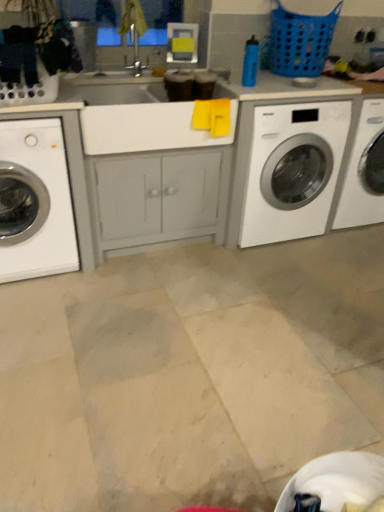
Where is `white glossy washing machine at center right, which is counted as the first washing machine, starting from the right`? The width and height of the screenshot is (384, 512). white glossy washing machine at center right, which is counted as the first washing machine, starting from the right is located at coordinates (293, 170).

You are a GUI agent. You are given a task and a screenshot of the screen. Output one action in this format:
    pyautogui.click(x=<x>, y=<y>)
    Task: Click on the blue plastic laundry basket at upper right
    
    Given the screenshot: What is the action you would take?
    (300, 42)

Which object is positioned more to the right, white glossy washing machine at left, which ranks as the 1th washing machine in left-to-right order, or white glossy washing machine at center right, which is counted as the first washing machine, starting from the right?

Positioned to the right is white glossy washing machine at center right, which is counted as the first washing machine, starting from the right.

Looking at this image, does white glossy washing machine at left, which ranks as the 1th washing machine in left-to-right order, come in front of white glossy washing machine at center right, which is counted as the first washing machine, starting from the right?

Yes, white glossy washing machine at left, which ranks as the 1th washing machine in left-to-right order, is in front of white glossy washing machine at center right, which is counted as the first washing machine, starting from the right.

How different are the orientations of white glossy washing machine at left, which ranks as the 1th washing machine in left-to-right order, and white glossy washing machine at center right, which is counted as the first washing machine, starting from the right, in degrees?

There is a 1.82e-05-degree angle between the facing directions of white glossy washing machine at left, which ranks as the 1th washing machine in left-to-right order, and white glossy washing machine at center right, which is counted as the first washing machine, starting from the right.

Does white glossy washing machine at left, positioned as the second washing machine in right-to-left order, have a lesser width compared to white glossy washing machine at center right, which is counted as the first washing machine, starting from the right?

Incorrect, the width of white glossy washing machine at left, positioned as the second washing machine in right-to-left order, is not less than that of white glossy washing machine at center right, which is counted as the first washing machine, starting from the right.

From a real-world perspective, is blue plastic laundry basket at upper right on top of white glossy washing machine at center right, the 2th washing machine from the left?

Correct, in the physical world, blue plastic laundry basket at upper right is higher than white glossy washing machine at center right, the 2th washing machine from the left.

Considering the positions of objects blue plastic laundry basket at upper right and white glossy washing machine at center right, which is counted as the first washing machine, starting from the right, in the image provided, who is behind, blue plastic laundry basket at upper right or white glossy washing machine at center right, which is counted as the first washing machine, starting from the right,?

blue plastic laundry basket at upper right is more distant.

Is blue plastic laundry basket at upper right wider than white glossy washing machine at center right, the 2th washing machine from the left?

In fact, blue plastic laundry basket at upper right might be narrower than white glossy washing machine at center right, the 2th washing machine from the left.

Is blue plastic laundry basket at upper right bigger than white glossy washing machine at center right, the 2th washing machine from the left?

Incorrect, blue plastic laundry basket at upper right is not larger than white glossy washing machine at center right, the 2th washing machine from the left.

Who is shorter, white glossy washing machine at center right, the 2th washing machine from the left, or blue plastic laundry basket at upper right?

blue plastic laundry basket at upper right.

Considering the relative sizes of white glossy washing machine at center right, which is counted as the first washing machine, starting from the right, and blue plastic laundry basket at upper right in the image provided, is white glossy washing machine at center right, which is counted as the first washing machine, starting from the right, wider than blue plastic laundry basket at upper right?

Result: Yes, white glossy washing machine at center right, which is counted as the first washing machine, starting from the right, is wider than blue plastic laundry basket at upper right.

Consider the image. Between white glossy washing machine at center right, which is counted as the first washing machine, starting from the right, and blue plastic laundry basket at upper right, which one has larger size?

With larger size is white glossy washing machine at center right, which is counted as the first washing machine, starting from the right.

Is white glossy washing machine at left, positioned as the second washing machine in right-to-left order, taller than blue plastic laundry basket at upper right?

Indeed, white glossy washing machine at left, positioned as the second washing machine in right-to-left order, has a greater height compared to blue plastic laundry basket at upper right.

Are white glossy washing machine at left, which ranks as the 1th washing machine in left-to-right order, and blue plastic laundry basket at upper right making contact?

No, white glossy washing machine at left, which ranks as the 1th washing machine in left-to-right order, is not beside blue plastic laundry basket at upper right.

From a real-world perspective, is white glossy washing machine at left, which ranks as the 1th washing machine in left-to-right order, physically below blue plastic laundry basket at upper right?

Yes, from a real-world perspective, white glossy washing machine at left, which ranks as the 1th washing machine in left-to-right order, is under blue plastic laundry basket at upper right.

Consider the image. Can you confirm if blue plastic laundry basket at upper right is shorter than white glossy washing machine at left, positioned as the second washing machine in right-to-left order?

Correct, blue plastic laundry basket at upper right is not as tall as white glossy washing machine at left, positioned as the second washing machine in right-to-left order.

Does blue plastic laundry basket at upper right touch white glossy washing machine at left, positioned as the second washing machine in right-to-left order?

No, blue plastic laundry basket at upper right is not making contact with white glossy washing machine at left, positioned as the second washing machine in right-to-left order.

Image resolution: width=384 pixels, height=512 pixels. What are the coordinates of `basket behind the white glossy washing machine at left, positioned as the second washing machine in right-to-left order` in the screenshot? It's located at (300, 42).

Between blue plastic laundry basket at upper right and white glossy washing machine at left, positioned as the second washing machine in right-to-left order, which one has smaller width?

Thinner between the two is blue plastic laundry basket at upper right.

Is the surface of white glossy washing machine at center right, which is counted as the first washing machine, starting from the right, in direct contact with white glossy washing machine at left, which ranks as the 1th washing machine in left-to-right order?

There is a gap between white glossy washing machine at center right, which is counted as the first washing machine, starting from the right, and white glossy washing machine at left, which ranks as the 1th washing machine in left-to-right order.

From a real-world perspective, is white glossy washing machine at center right, which is counted as the first washing machine, starting from the right, physically above white glossy washing machine at left, which ranks as the 1th washing machine in left-to-right order?

No, from a real-world perspective, white glossy washing machine at center right, which is counted as the first washing machine, starting from the right, is not above white glossy washing machine at left, which ranks as the 1th washing machine in left-to-right order.

You are a GUI agent. You are given a task and a screenshot of the screen. Output one action in this format:
    pyautogui.click(x=<x>, y=<y>)
    Task: Click on the washing machine located underneath the white glossy washing machine at left, positioned as the second washing machine in right-to-left order (from a real-world perspective)
    This screenshot has width=384, height=512.
    Given the screenshot: What is the action you would take?
    pyautogui.click(x=293, y=170)

This screenshot has height=512, width=384. I want to click on basket behind the white glossy washing machine at center right, the 2th washing machine from the left, so click(x=300, y=42).

Considering their positions, is white glossy washing machine at left, positioned as the second washing machine in right-to-left order, positioned further to white glossy washing machine at center right, the 2th washing machine from the left, than blue plastic laundry basket at upper right?

white glossy washing machine at left, positioned as the second washing machine in right-to-left order, is positioned further to the anchor white glossy washing machine at center right, the 2th washing machine from the left.

Which object lies nearer to the anchor point white glossy washing machine at center right, the 2th washing machine from the left, blue plastic laundry basket at upper right or white glossy washing machine at left, positioned as the second washing machine in right-to-left order?

blue plastic laundry basket at upper right is closer to white glossy washing machine at center right, the 2th washing machine from the left.

From the image, which object appears to be farther from blue plastic laundry basket at upper right, white glossy washing machine at center right, the 2th washing machine from the left, or white glossy washing machine at left, which ranks as the 1th washing machine in left-to-right order?

white glossy washing machine at left, which ranks as the 1th washing machine in left-to-right order, lies further to blue plastic laundry basket at upper right than the other object.

Based on their spatial positions, is white glossy washing machine at center right, which is counted as the first washing machine, starting from the right, or blue plastic laundry basket at upper right further from white glossy washing machine at left, which ranks as the 1th washing machine in left-to-right order?

Among the two, blue plastic laundry basket at upper right is located further to white glossy washing machine at left, which ranks as the 1th washing machine in left-to-right order.

Estimate the real-world distances between objects in this image. Which object is closer to white glossy washing machine at left, which ranks as the 1th washing machine in left-to-right order, blue plastic laundry basket at upper right or white glossy washing machine at center right, which is counted as the first washing machine, starting from the right?

Based on the image, white glossy washing machine at center right, which is counted as the first washing machine, starting from the right, appears to be nearer to white glossy washing machine at left, which ranks as the 1th washing machine in left-to-right order.

Looking at the image, which one is located closer to blue plastic laundry basket at upper right, white glossy washing machine at left, positioned as the second washing machine in right-to-left order, or white glossy washing machine at center right, the 2th washing machine from the left?

white glossy washing machine at center right, the 2th washing machine from the left, lies closer to blue plastic laundry basket at upper right than the other object.

This screenshot has height=512, width=384. What are the coordinates of `washing machine between white glossy washing machine at left, positioned as the second washing machine in right-to-left order, and blue plastic laundry basket at upper right from left to right` in the screenshot? It's located at (293, 170).